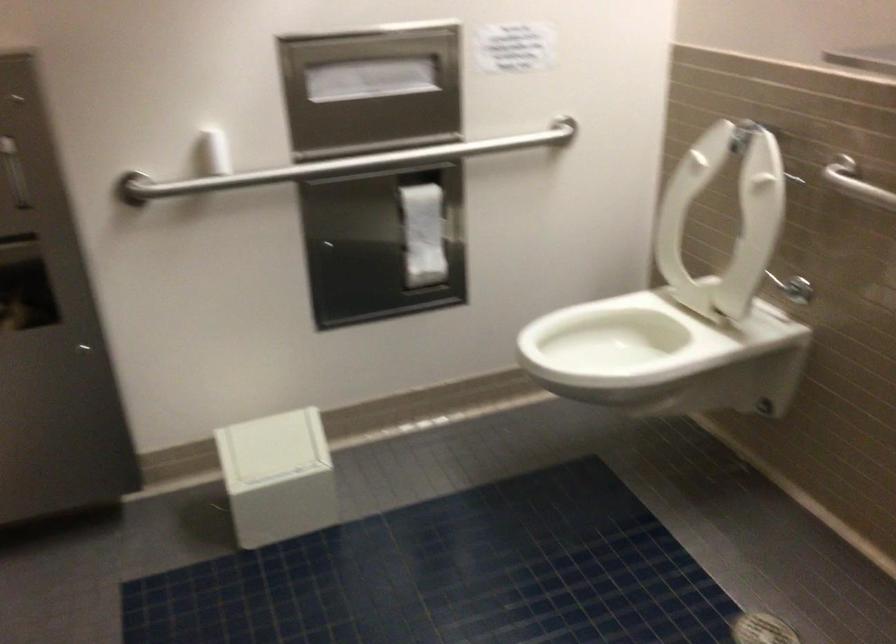
The width and height of the screenshot is (896, 644). I want to click on white toilet seat, so click(616, 336).